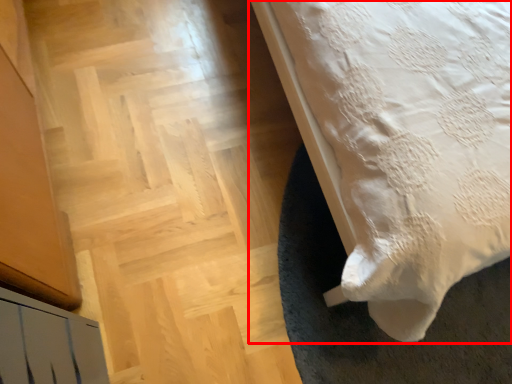
Question: From the image's perspective, what is the correct spatial relationship of bed (annotated by the red box) in relation to stairwell?

Choices:
 (A) above
 (B) below

Answer: (A)